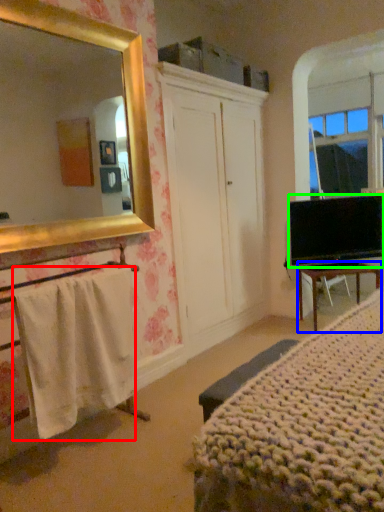
Question: Which object is the closest to the towel/napkin (highlighted by a red box)? Choose among these: desk (highlighted by a blue box) or television (highlighted by a green box).

Choices:
 (A) desk
 (B) television

Answer: (A)